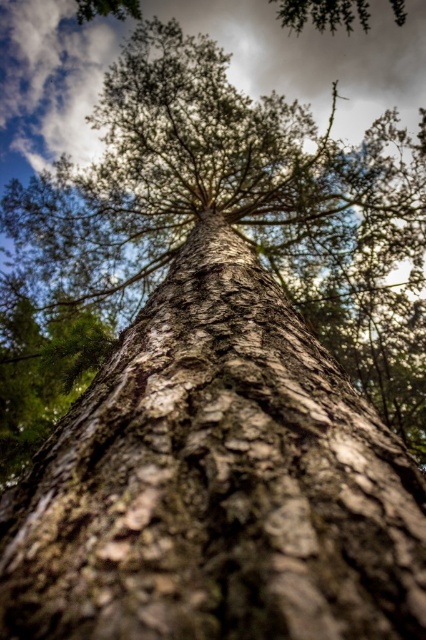
Is brown rough bark tree trunk at center wider than white fluffy cloud at upper center?

Incorrect, brown rough bark tree trunk at center's width does not surpass white fluffy cloud at upper center's.

Does brown rough bark tree trunk at center appear over white fluffy cloud at upper center?

No, brown rough bark tree trunk at center is not above white fluffy cloud at upper center.

Does point (244, 266) come in front of point (51, 157)?

Yes.

You are a GUI agent. You are given a task and a screenshot of the screen. Output one action in this format:
    pyautogui.click(x=<x>, y=<y>)
    Task: Click on the brown rough bark tree trunk at center
    This screenshot has width=426, height=640.
    Given the screenshot: What is the action you would take?
    pyautogui.click(x=215, y=483)